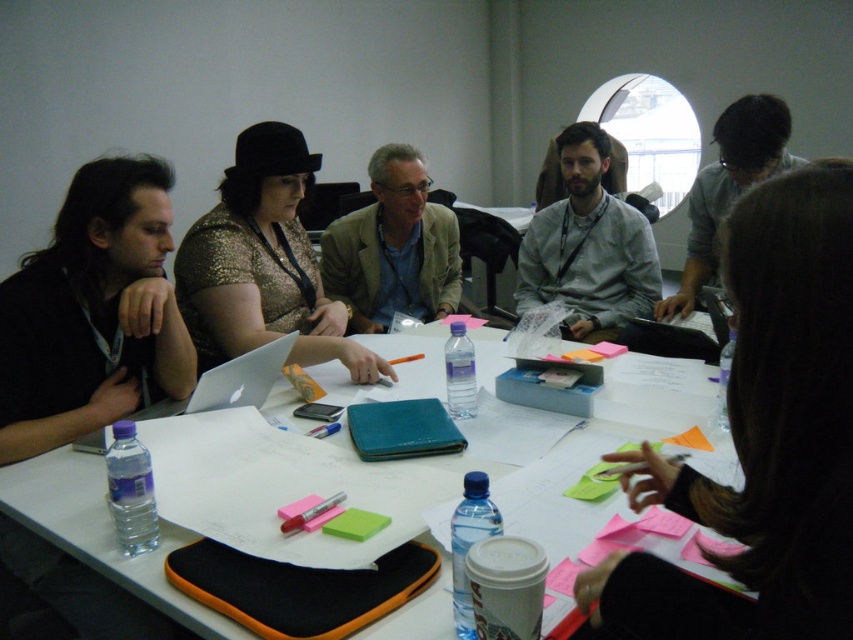
Question: Estimate the real-world distances between objects in this image. Which object is farther from the black matte shirt at left?

Choices:
 (A) gray fabric shirt at upper right
 (B) matte white laptop at center
 (C) white paper at center
 (D) dark brown hair at center

Answer: (A)

Question: Does black matte shirt at left have a lesser width compared to gray fabric shirt at upper right?

Choices:
 (A) no
 (B) yes

Answer: (B)

Question: Does black matte shirt at left have a greater width compared to matte beige blazer at center?

Choices:
 (A) no
 (B) yes

Answer: (A)

Question: Which point is closer to the camera taking this photo?

Choices:
 (A) (164, 376)
 (B) (577, 593)
 (C) (613, 300)
 (D) (345, 317)

Answer: (B)

Question: Is white paper at center wider than gray fabric shirt at upper right?

Choices:
 (A) yes
 (B) no

Answer: (A)

Question: Which point is closer to the camera?

Choices:
 (A) (206, 400)
 (B) (694, 301)
 (C) (564, 216)

Answer: (A)